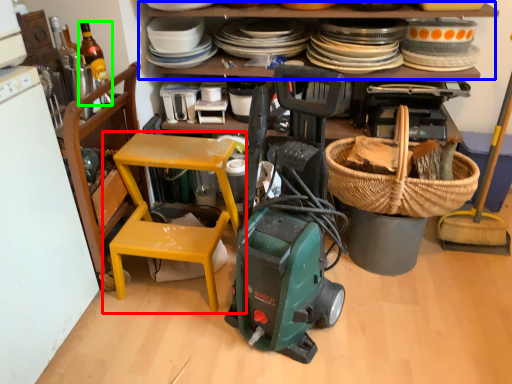
Question: Which object is the farthest from chair (highlighted by a red box)? Choose among these: shelf (highlighted by a blue box) or bottle (highlighted by a green box).

Choices:
 (A) shelf
 (B) bottle

Answer: (A)